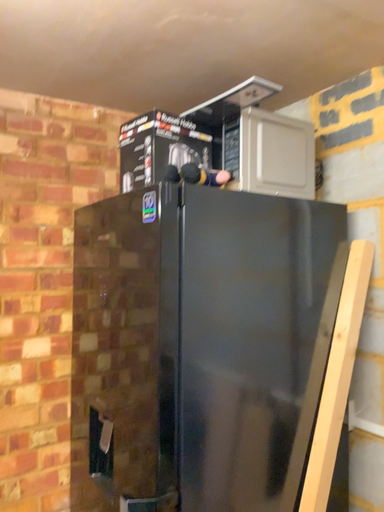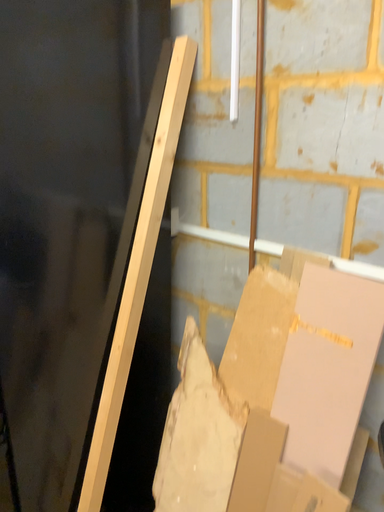
Question: Which way did the camera rotate in the video?

Choices:
 (A) rotated upward
 (B) rotated downward

Answer: (B)